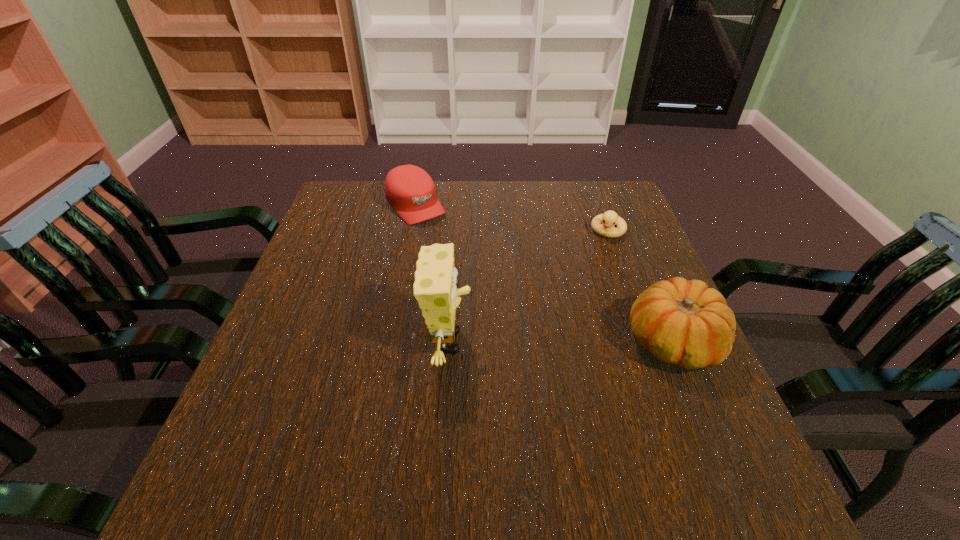
You are a GUI agent. You are given a task and a screenshot of the screen. Output one action in this format:
    pyautogui.click(x=<x>, y=<y>)
    Task: Click on the vacant area situated on the front-facing side of the second shortest object
    
    Given the screenshot: What is the action you would take?
    pyautogui.click(x=510, y=306)

You are a GUI agent. You are given a task and a screenshot of the screen. Output one action in this format:
    pyautogui.click(x=<x>, y=<y>)
    Task: Click on the vacant space located 0.240m on the front-facing side of the second shortest object
    The image size is (960, 540).
    Given the screenshot: What is the action you would take?
    pyautogui.click(x=475, y=270)

Image resolution: width=960 pixels, height=540 pixels. Find the location of `duckling at the far edge`. duckling at the far edge is located at coordinates (610, 218).

Where is `cap present at the far edge`? cap present at the far edge is located at coordinates (410, 191).

Where is `gourd that is positioned at the right edge`? The image size is (960, 540). gourd that is positioned at the right edge is located at coordinates pyautogui.click(x=682, y=322).

Locate an element on the screen. The width and height of the screenshot is (960, 540). duckling situated at the right edge is located at coordinates (610, 218).

Locate an element on the screen. The width and height of the screenshot is (960, 540). object located in the far right corner section of the desktop is located at coordinates (610, 218).

This screenshot has width=960, height=540. Find the location of `vacant area at the far edge of the desktop`. vacant area at the far edge of the desktop is located at coordinates (550, 210).

Image resolution: width=960 pixels, height=540 pixels. In the image, there is a desktop. Find the location of `blank space at the near edge`. blank space at the near edge is located at coordinates (x=516, y=434).

Locate an element on the screen. The image size is (960, 540). vacant area at the left edge is located at coordinates (300, 287).